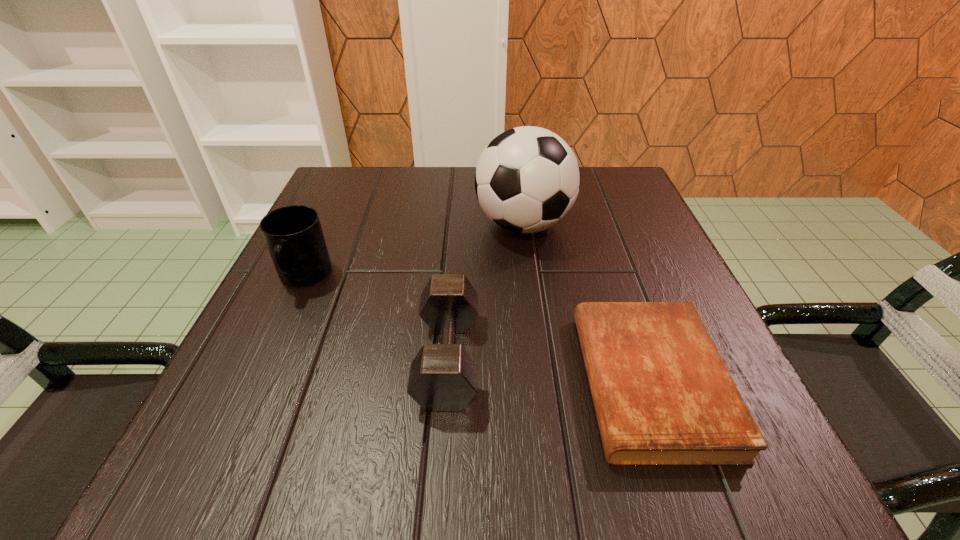
Find the location of `blank region between the farthest object and the second tallest object`. blank region between the farthest object and the second tallest object is located at coordinates (414, 251).

Locate an element on the screen. The image size is (960, 540). empty space that is in between the dumbbell and the mug is located at coordinates (375, 317).

The width and height of the screenshot is (960, 540). What are the coordinates of `free point between the third nearest object and the farthest object` in the screenshot? It's located at (414, 251).

Where is `object that is the third nearest to the dumbbell`? object that is the third nearest to the dumbbell is located at coordinates (293, 234).

At what (x,y) coordinates should I click in order to perform the action: click on object that is the third closest to the shortest object. Please return your answer as a coordinate pair (x, y). The height and width of the screenshot is (540, 960). Looking at the image, I should click on (293, 234).

Where is `blank space that satisfies the following two spatial constraints: 1. on the side of the third nearest object with the handle; 2. on the left side of the second shortest object`? Image resolution: width=960 pixels, height=540 pixels. blank space that satisfies the following two spatial constraints: 1. on the side of the third nearest object with the handle; 2. on the left side of the second shortest object is located at coordinates (267, 357).

Find the location of `free space that satisfies the following two spatial constraints: 1. on the back side of the dumbbell; 2. on the left side of the soccer ball`. free space that satisfies the following two spatial constraints: 1. on the back side of the dumbbell; 2. on the left side of the soccer ball is located at coordinates (457, 225).

This screenshot has height=540, width=960. What are the coordinates of `vacant region that satisfies the following two spatial constraints: 1. on the side of the dumbbell with the handle; 2. on the right side of the leftmost object` in the screenshot? It's located at (267, 357).